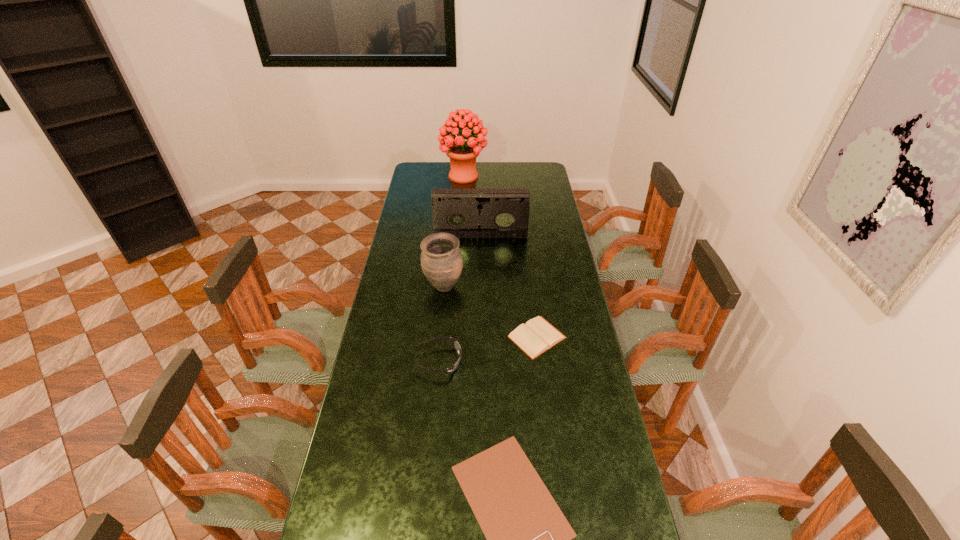
Image resolution: width=960 pixels, height=540 pixels. I want to click on the tallest object, so click(462, 154).

Identify the location of the farthest object. This screenshot has width=960, height=540. (462, 154).

Where is `videotape`? The image size is (960, 540). videotape is located at coordinates (465, 213).

Locate an element on the screen. urn is located at coordinates [x=441, y=260].

At what (x,y) coordinates should I click in order to perform the action: click on sunglasses. Please return your answer as a coordinate pair (x, y). The height and width of the screenshot is (540, 960). Looking at the image, I should click on tap(456, 345).

Find the location of a particular element. the second shortest object is located at coordinates (536, 336).

Where is `vacant space positioned 0.140m on the right of the bouquet`? vacant space positioned 0.140m on the right of the bouquet is located at coordinates (512, 176).

The height and width of the screenshot is (540, 960). Find the location of `free location located 0.130m on the front side of the videotape`. free location located 0.130m on the front side of the videotape is located at coordinates (481, 255).

Image resolution: width=960 pixels, height=540 pixels. Identify the location of vacant space positioned 0.330m on the back of the urn. (449, 230).

This screenshot has width=960, height=540. I want to click on free space located on the lenses of the fourth tallest object, so click(x=492, y=361).